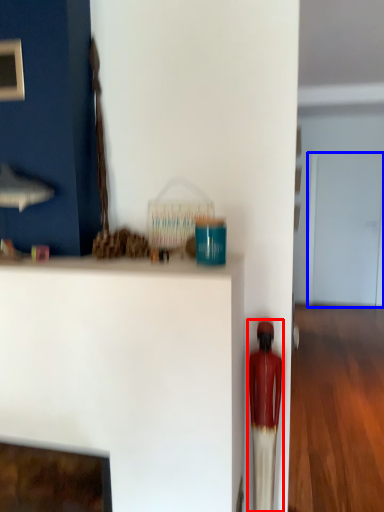
Question: Which object appears farthest to the camera in this image, toy (highlighted by a red box) or glass door (highlighted by a blue box)?

Choices:
 (A) toy
 (B) glass door

Answer: (B)